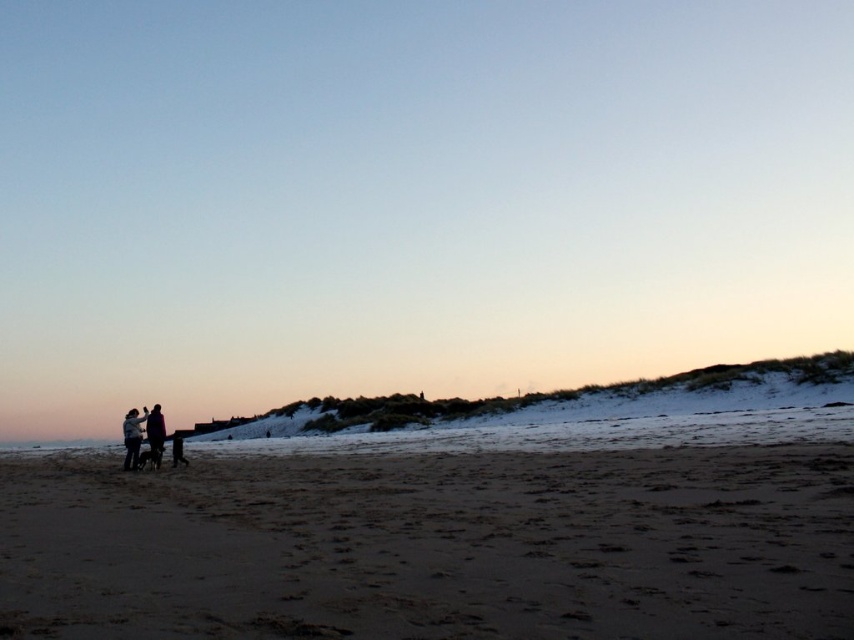
Is silhouette clothing at lower left further to camera compared to dark blue jacket at lower left?

No, it is not.

Who is positioned more to the left, silhouette clothing at lower left or dark blue jacket at lower left?

silhouette clothing at lower left

This screenshot has height=640, width=854. Describe the element at coordinates (142, 436) in the screenshot. I see `silhouette clothing at lower left` at that location.

Identify the location of silhouette clothing at lower left. (142, 436).

Who is more forward, (x=653, y=548) or (x=158, y=429)?

Point (x=653, y=548) is in front.

Identify the location of brown sandy beach at lower left. Image resolution: width=854 pixels, height=640 pixels. (433, 547).

Locate an element on the screen. Image resolution: width=854 pixels, height=640 pixels. brown sandy beach at lower left is located at coordinates (433, 547).

Between brown sandy beach at lower left and light gray fabric jacket at lower left, which one has less height?

With less height is brown sandy beach at lower left.

Is point (735, 477) positioned after point (147, 410)?

No, it is not.

Measure the distance between brown sandy beach at lower left and camera.

They are 9.22 meters apart.

This screenshot has width=854, height=640. Identify the location of brown sandy beach at lower left. (433, 547).